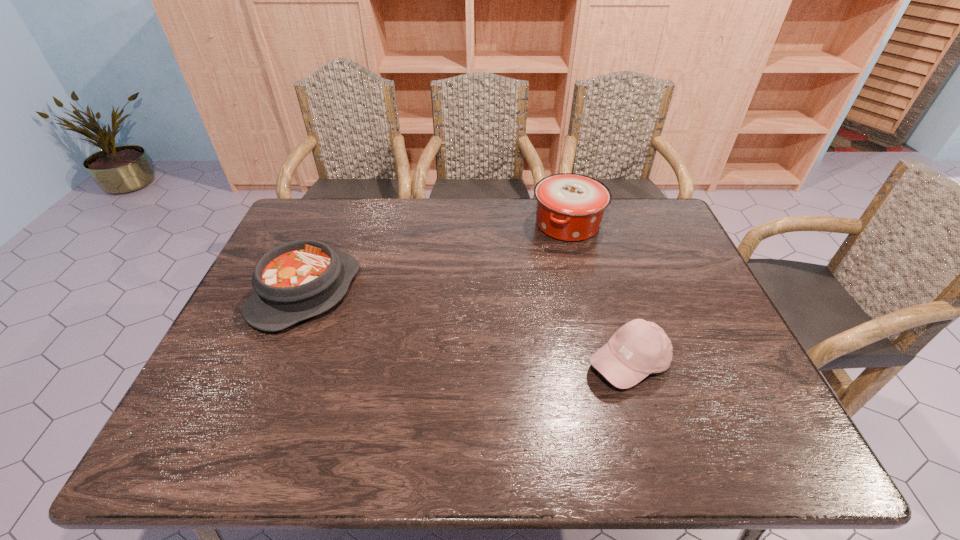
Where is `vacant area that lies between the taller casserole and the nearer casserole`? Image resolution: width=960 pixels, height=540 pixels. vacant area that lies between the taller casserole and the nearer casserole is located at coordinates (437, 259).

The height and width of the screenshot is (540, 960). What are the coordinates of `vacant area that lies between the farther casserole and the baseball cap` in the screenshot? It's located at (598, 294).

At what (x,y) coordinates should I click in order to perform the action: click on unoccupied position between the baseball cap and the left casserole. Please return your answer as a coordinate pair (x, y). Image resolution: width=960 pixels, height=540 pixels. Looking at the image, I should click on (468, 328).

Find the location of `free space between the shorter casserole and the baseball cap`. free space between the shorter casserole and the baseball cap is located at coordinates (468, 328).

This screenshot has height=540, width=960. Identify the location of free area in between the baseball cap and the farther casserole. (598, 294).

Point out which object is positioned as the nearest to the left casserole. Please provide its 2D coordinates. Your answer should be formatted as a tuple, i.e. [(x, y)], where the tuple contains the x and y coordinates of a point satisfying the conditions above.

[(570, 207)]

Identify which object is located as the second nearest to the leftmost object. Please provide its 2D coordinates. Your answer should be formatted as a tuple, i.e. [(x, y)], where the tuple contains the x and y coordinates of a point satisfying the conditions above.

[(639, 348)]

Find the location of a particular element. Image resolution: width=960 pixels, height=540 pixels. vacant point that satisfies the following two spatial constraints: 1. on the back side of the right casserole; 2. on the left side of the leftmost object is located at coordinates (334, 224).